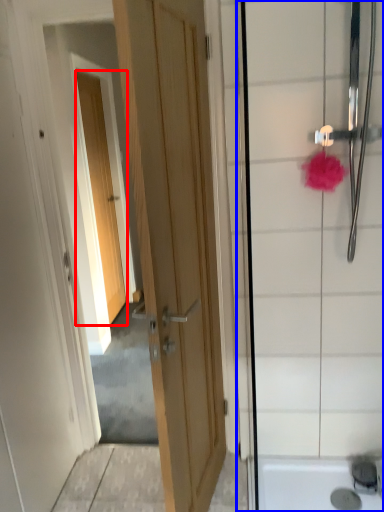
Question: Which object appears closest to the camera in this image, door (highlighted by a red box) or shower door (highlighted by a blue box)?

Choices:
 (A) door
 (B) shower door

Answer: (B)